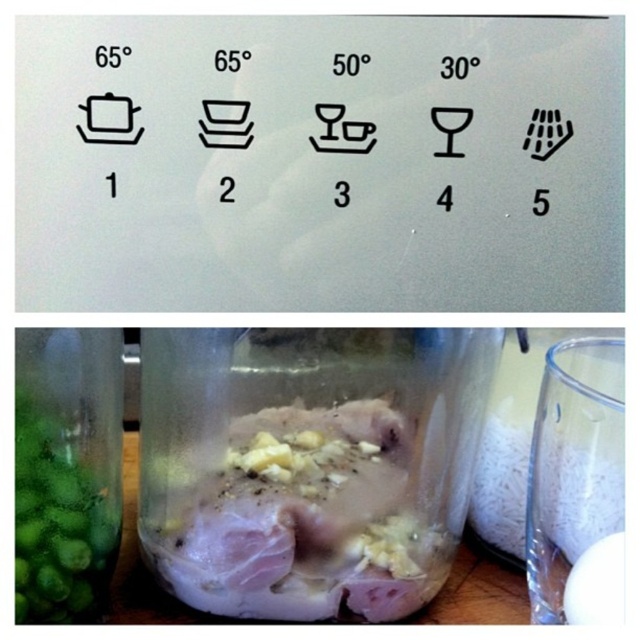
Based on the photo, is translucent plastic chicken at center smaller than transparent glass jar at right?

No, translucent plastic chicken at center is not smaller than transparent glass jar at right.

Is translucent plastic chicken at center taller than transparent glass jar at right?

Yes.

The image size is (640, 640). I want to click on translucent plastic chicken at center, so click(x=317, y=465).

Does translucent plastic chicken at center have a lesser width compared to green matte glass jar at lower left?

No.

Locate an element on the screen. Image resolution: width=640 pixels, height=640 pixels. translucent plastic chicken at center is located at coordinates (317, 465).

Consider the image. Is green matte glass jar at lower left closer to the viewer compared to transparent glass jar at right?

No, it is behind transparent glass jar at right.

From the picture: Does green matte glass jar at lower left have a smaller size compared to transparent glass jar at right?

Yes, green matte glass jar at lower left is smaller than transparent glass jar at right.

Which is behind, point (54, 563) or point (557, 570)?

The point (54, 563) is more distant.

Image resolution: width=640 pixels, height=640 pixels. I want to click on green matte glass jar at lower left, so click(67, 472).